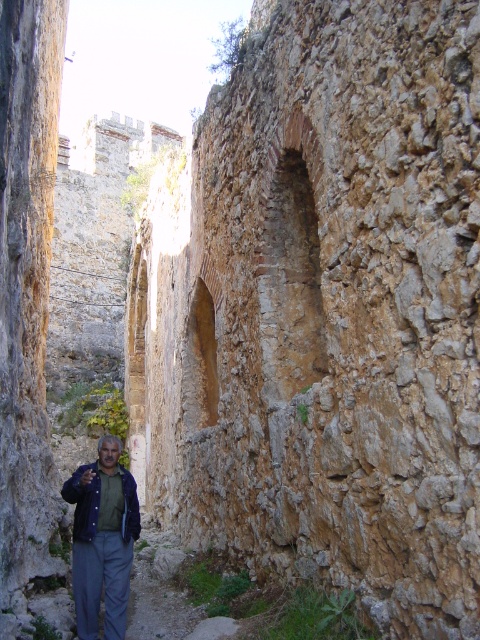
Question: Does brown rough stone wall at center have a larger size compared to blue denim jacket at lower left?

Choices:
 (A) no
 (B) yes

Answer: (B)

Question: Is brown rough stone wall at center closer to the viewer compared to blue denim jacket at lower left?

Choices:
 (A) no
 (B) yes

Answer: (B)

Question: Which object is farther from the camera taking this photo?

Choices:
 (A) brown rough stone wall at center
 (B) blue denim jacket at lower left

Answer: (B)

Question: Which object is closer to the camera taking this photo?

Choices:
 (A) blue denim jacket at lower left
 (B) brown rough stone wall at center

Answer: (B)

Question: Is brown rough stone wall at center positioned in front of blue denim jacket at lower left?

Choices:
 (A) yes
 (B) no

Answer: (A)